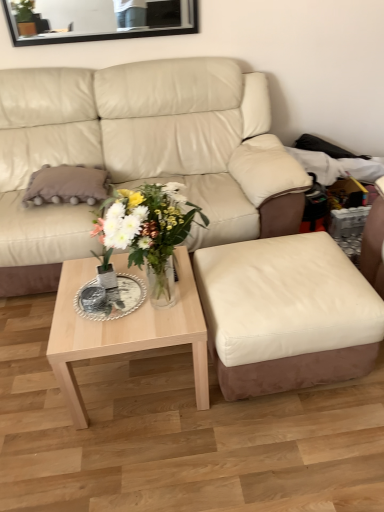
Locate an element on the screen. leather ottoman at center is located at coordinates (286, 314).

Measure the distance between point (111, 33) and camera.

Point (111, 33) is 8.23 feet from camera.

What is the approximate height of gray fluffy pillow at left?

14.36 centimeters.

Identify the location of gray fluffy pillow at left. (67, 185).

This screenshot has height=512, width=384. Identify the location of light wood/texture coffee table at center. (125, 333).

Does black glass mirror at upper center contain clear glass vase at center?

No, black glass mirror at upper center does not contain clear glass vase at center.

Locate an element on the screen. The width and height of the screenshot is (384, 512). mirror located above the clear glass vase at center (from the image's perspective) is located at coordinates (97, 19).

Looking at this image, considering the sizes of black glass mirror at upper center and clear glass vase at center in the image, is black glass mirror at upper center bigger or smaller than clear glass vase at center?

In the image, black glass mirror at upper center appears to be smaller than clear glass vase at center.

In the scene shown: How many degrees apart are the facing directions of black glass mirror at upper center and clear glass vase at center?

The angle between the facing direction of black glass mirror at upper center and the facing direction of clear glass vase at center is 0.574 degrees.

Looking at the image, does light wood/texture coffee table at center seem bigger or smaller compared to gray fluffy pillow at left?

Considering their sizes, light wood/texture coffee table at center takes up more space than gray fluffy pillow at left.

Is light wood/texture coffee table at center not inside gray fluffy pillow at left?

Absolutely, light wood/texture coffee table at center is external to gray fluffy pillow at left.

What's the angular difference between light wood/texture coffee table at center and gray fluffy pillow at left's facing directions?

There is a 1.37-degree angle between the facing directions of light wood/texture coffee table at center and gray fluffy pillow at left.

At what (x,y) coordinates should I click in order to perform the action: click on pillow behind the light wood/texture coffee table at center. Please return your answer as a coordinate pair (x, y). The height and width of the screenshot is (512, 384). Looking at the image, I should click on (67, 185).

Are clear glass vase at center and leather ottoman at center located far from each other?

That's not correct — clear glass vase at center is a little close to leather ottoman at center.

Considering the sizes of objects clear glass vase at center and leather ottoman at center in the image provided, who is smaller, clear glass vase at center or leather ottoman at center?

clear glass vase at center is smaller.

Which object is positioned more to the right, clear glass vase at center or leather ottoman at center?

Positioned to the right is leather ottoman at center.

Does leather ottoman at center come in front of gray fluffy pillow at left?

Yes, leather ottoman at center is in front of gray fluffy pillow at left.

Is leather ottoman at center placed right next to gray fluffy pillow at left?

No.

In terms of height, does leather ottoman at center look taller or shorter compared to gray fluffy pillow at left?

In the image, leather ottoman at center appears to be taller than gray fluffy pillow at left.

What's the angular difference between leather ottoman at center and gray fluffy pillow at left's facing directions?

The angular difference between leather ottoman at center and gray fluffy pillow at left is 2.73 degrees.

How many degrees apart are the facing directions of black glass mirror at upper center and light wood/texture coffee table at center?

There is a 1.74-degree angle between the facing directions of black glass mirror at upper center and light wood/texture coffee table at center.

Between black glass mirror at upper center and light wood/texture coffee table at center, which one has larger size?

light wood/texture coffee table at center.

From a real-world perspective, is black glass mirror at upper center positioned above or below light wood/texture coffee table at center?

black glass mirror at upper center is above light wood/texture coffee table at center.

Does black glass mirror at upper center have a greater height compared to gray fluffy pillow at left?

Indeed, black glass mirror at upper center has a greater height compared to gray fluffy pillow at left.

Considering the relative sizes of black glass mirror at upper center and gray fluffy pillow at left in the image provided, is black glass mirror at upper center smaller than gray fluffy pillow at left?

Indeed, black glass mirror at upper center has a smaller size compared to gray fluffy pillow at left.

Is black glass mirror at upper center at the right side of gray fluffy pillow at left?

Yes, black glass mirror at upper center is to the right of gray fluffy pillow at left.

From a real-world perspective, is black glass mirror at upper center positioned above or below leather ottoman at center?

Clearly, from a real-world perspective, black glass mirror at upper center is above leather ottoman at center.

Image resolution: width=384 pixels, height=512 pixels. Identify the location of swivel chair that appears in front of the black glass mirror at upper center. (286, 314).

Which is more to the right, black glass mirror at upper center or leather ottoman at center?

leather ottoman at center is more to the right.

Identify the location of houseplant on the right side of black glass mirror at upper center. This screenshot has height=512, width=384. (148, 231).

Locate an element on the screen. coffee table below the gray fluffy pillow at left (from the image's perspective) is located at coordinates (125, 333).

Based on their spatial positions, is clear glass vase at center or light wood/texture coffee table at center further from gray fluffy pillow at left?

Based on the image, light wood/texture coffee table at center appears to be further to gray fluffy pillow at left.

Considering their positions, is light wood/texture coffee table at center positioned further to gray fluffy pillow at left than beige leather couch at center?

light wood/texture coffee table at center is further to gray fluffy pillow at left.

Considering their positions, is leather ottoman at center positioned closer to clear glass vase at center than beige leather couch at center?

Based on the image, leather ottoman at center appears to be nearer to clear glass vase at center.

From the picture: Which object lies further to the anchor point leather ottoman at center, clear glass vase at center or beige leather couch at center?

beige leather couch at center lies further to leather ottoman at center than the other object.

Based on their spatial positions, is gray fluffy pillow at left or clear glass vase at center further from black glass mirror at upper center?

The object further to black glass mirror at upper center is clear glass vase at center.

When comparing their distances from black glass mirror at upper center, does leather ottoman at center or gray fluffy pillow at left seem closer?

The object closer to black glass mirror at upper center is gray fluffy pillow at left.

Based on their spatial positions, is gray fluffy pillow at left or clear glass vase at center closer to light wood/texture coffee table at center?

Among the two, clear glass vase at center is located nearer to light wood/texture coffee table at center.

When comparing their distances from clear glass vase at center, does black glass mirror at upper center or light wood/texture coffee table at center seem closer?

light wood/texture coffee table at center.

Image resolution: width=384 pixels, height=512 pixels. What are the coordinates of `houseplant between beige leather couch at center and light wood/texture coffee table at center from top to bottom` in the screenshot? It's located at (148, 231).

At what (x,y) coordinates should I click in order to perform the action: click on houseplant between light wood/texture coffee table at center and leather ottoman at center from left to right. Please return your answer as a coordinate pair (x, y). This screenshot has height=512, width=384. Looking at the image, I should click on (148, 231).

Where is `studio couch between black glass mirror at upper center and clear glass vase at center vertically`? The image size is (384, 512). studio couch between black glass mirror at upper center and clear glass vase at center vertically is located at coordinates (139, 155).

Identify the location of studio couch that lies between black glass mirror at upper center and gray fluffy pillow at left from top to bottom. (139, 155).